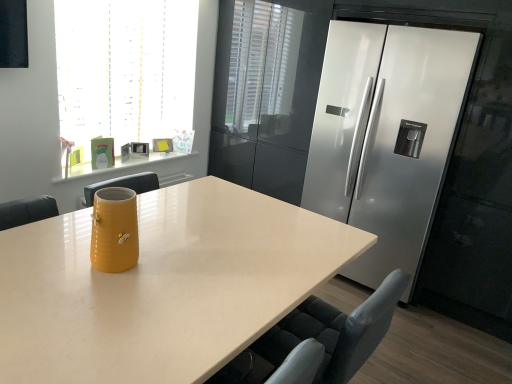
Question: Considering the positions of yellow ceramic vase at center and satin silver refrigerator at right in the image, is yellow ceramic vase at center bigger or smaller than satin silver refrigerator at right?

Choices:
 (A) small
 (B) big

Answer: (A)

Question: Relative to satin silver refrigerator at right, is yellow ceramic vase at center in front or behind?

Choices:
 (A) behind
 (B) front

Answer: (B)

Question: Which is farther from the yellow ceramic vase at center?

Choices:
 (A) satin silver refrigerator at right
 (B) matte yellow vase at center
 (C) translucent glass window at upper left
 (D) matte gray swivel chair at lower right
 (E) yellow matte mug at upper left

Answer: (A)

Question: Based on their relative distances, which object is nearer to the matte yellow vase at center?

Choices:
 (A) satin silver refrigerator at right
 (B) yellow matte mug at upper left
 (C) matte gray swivel chair at lower right
 (D) translucent glass window at upper left
 (E) yellow ceramic vase at center

Answer: (E)